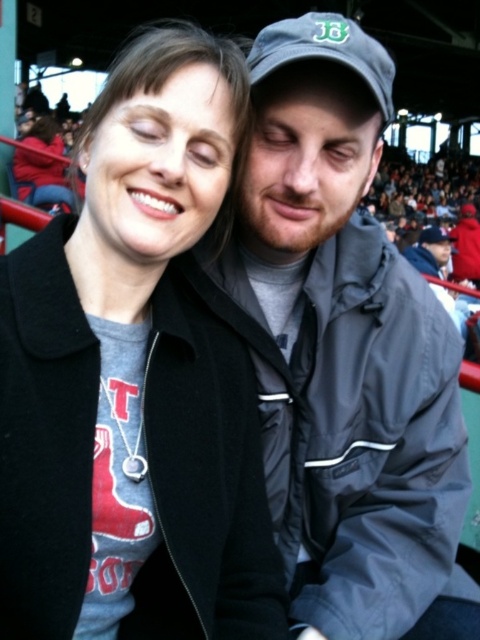
Does point (176, 148) come closer to viewer compared to point (41, 145)?

Yes, point (176, 148) is closer to viewer.

Is gray matte jacket at center positioned at the back of matte gray sweatshirt at upper left?

No, gray matte jacket at center is in front of matte gray sweatshirt at upper left.

Is point (199, 296) positioned before point (26, 198)?

Yes, it is in front of point (26, 198).

What are the coordinates of `gray matte jacket at center` in the screenshot? It's located at pos(135,378).

Which of these two, gray matte jacket at center or gray fabric jacket at center, stands shorter?

gray fabric jacket at center is shorter.

Identify the location of gray matte jacket at center. (135, 378).

Which is behind, point (356, 483) or point (35, 189)?

Point (35, 189)

Between gray fabric jacket at center and matte gray sweatshirt at upper left, which one has less height?

gray fabric jacket at center

Where is `gray fabric jacket at center`? gray fabric jacket at center is located at coordinates (345, 349).